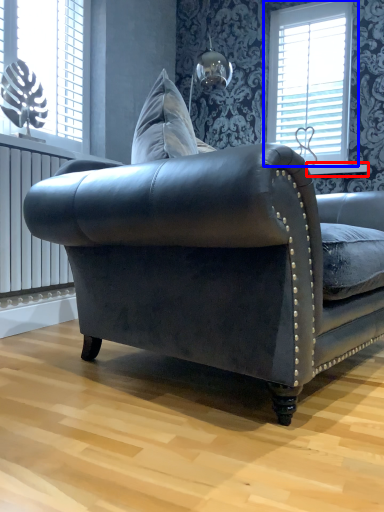
Question: Which object is further to the camera taking this photo, window sill (highlighted by a red box) or window (highlighted by a blue box)?

Choices:
 (A) window sill
 (B) window

Answer: (B)